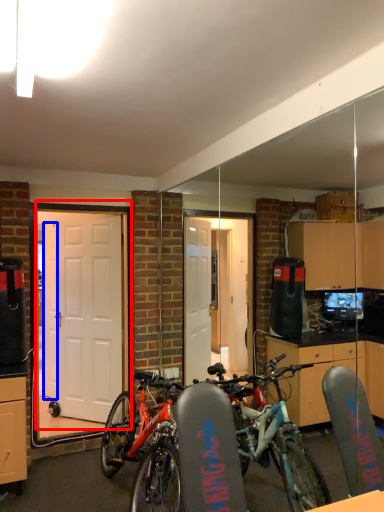
Question: Which object appears closest to the camera in this image, door (highlighted by a red box) or door (highlighted by a blue box)?

Choices:
 (A) door
 (B) door

Answer: (A)